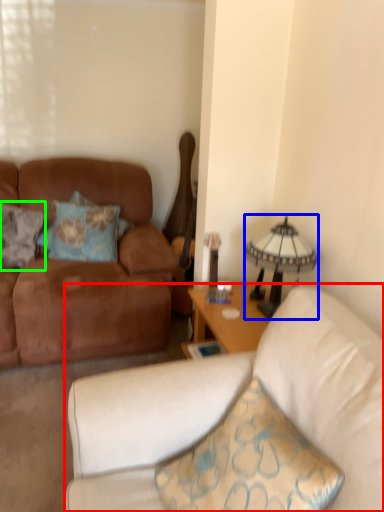
Question: Which object is positioned closest to studio couch (highlighted by a red box)? Select from lamp (highlighted by a blue box) and pillow (highlighted by a green box).

Choices:
 (A) lamp
 (B) pillow

Answer: (A)